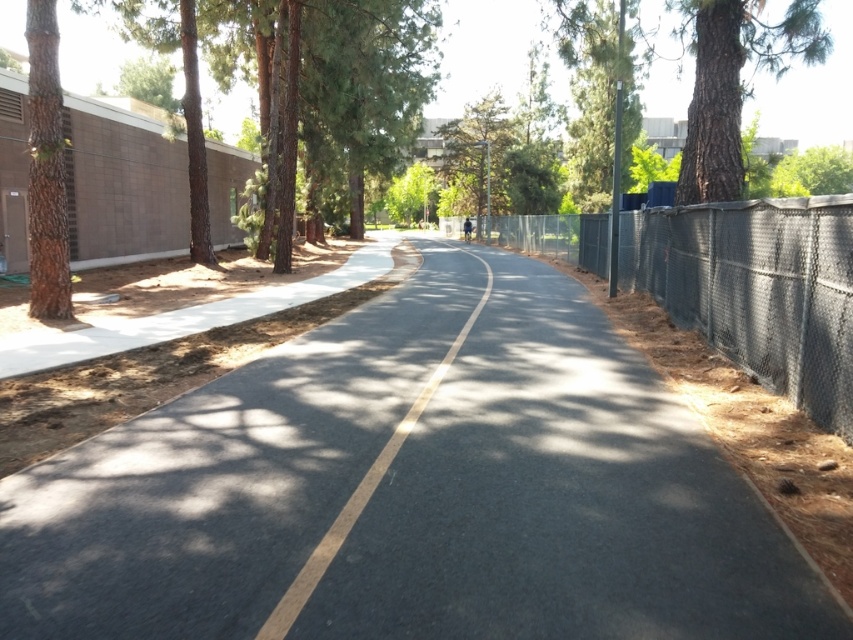
You are a pedestrian walking along the black asphalt road at center and want to reach the brown rough bark tree at left. Which direction should you walk to get there?

The brown rough bark tree at left is positioned on the left side of the black asphalt road at center, so you should walk towards the left to reach it.

You are a delivery robot that needs to navigate along the black asphalt road at center. There is a green leafy tree at center above you. Can you pass through this area without hitting the tree?

The black asphalt road at center is positioned under the green leafy tree at center, so the robot can pass through safely as the road is below the tree and there is no obstruction in its path.